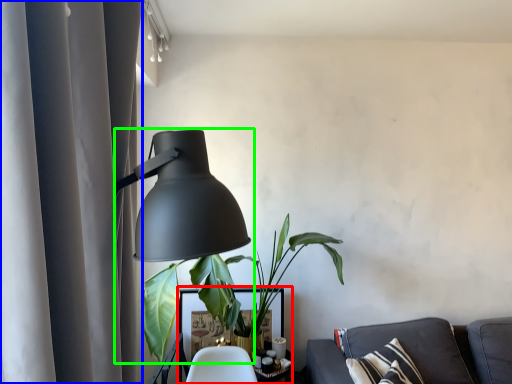
Question: Which is nearer to the table (highlighted by a red box)? curtain (highlighted by a blue box) or lamp (highlighted by a green box).

Choices:
 (A) curtain
 (B) lamp

Answer: (B)